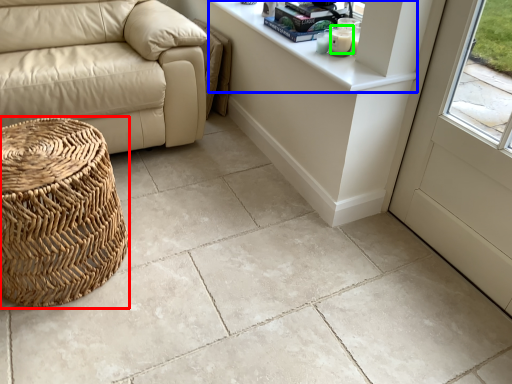
Question: Estimate the real-world distances between objects in this image. Which object is farther from basket (highlighted by a red box), counter top (highlighted by a blue box) or candle (highlighted by a green box)?

Choices:
 (A) counter top
 (B) candle

Answer: (B)